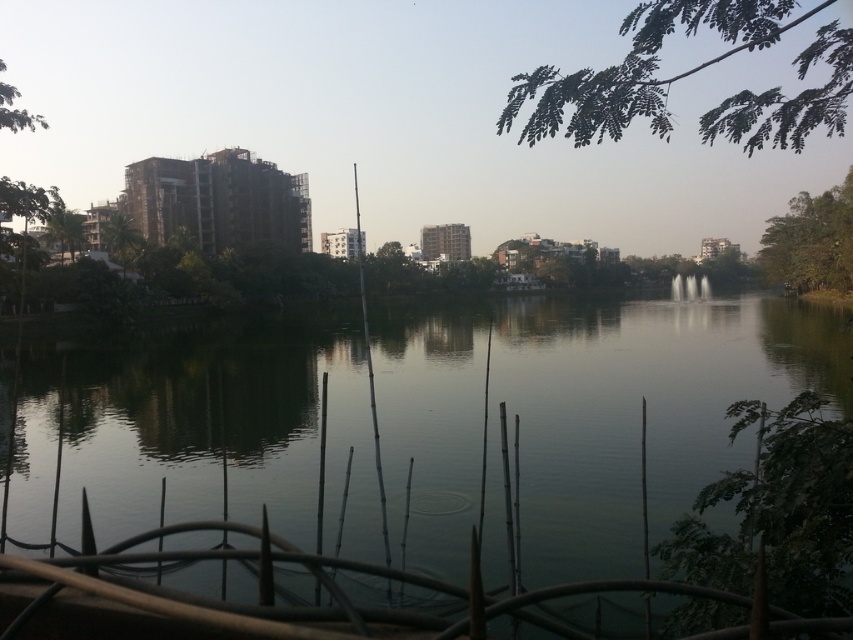
You are a photographer trying to capture the reflection of the green leafy branch at upper right and the green leafy tree at upper left in the water. Which object will have its reflection closer to the right side of the water surface?

The green leafy branch at upper right is positioned on the right side of green leafy tree at upper left, so its reflection will be closer to the right side of the water surface.

You are standing at the center of the railing and want to observe both the green leafy tree at lower right and the green leafy branch at upper right. Which one would you look down at and which one would you look up at?

You would look down at the green leafy tree at lower right and look up at the green leafy branch at upper right because the green leafy tree at lower right is below the green leafy branch at upper right.

You are an architect designing a new garden and want to incorporate elements from this scene. If you need to choose between the green leafy branch at upper right and the green leafy tree at upper left for a design that requires a wider element, which one should you select?

The green leafy branch at upper right is wider than the green leafy tree at upper left, so you should select the green leafy branch at upper right for the design requiring a wider element.